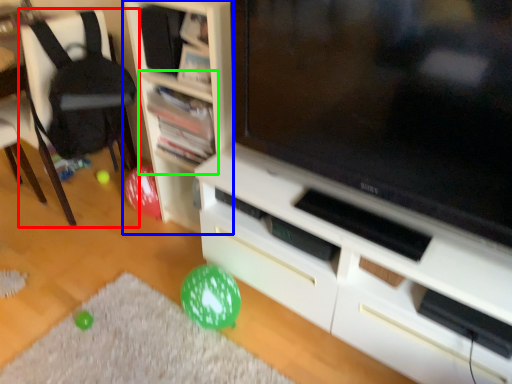
Question: Estimate the real-world distances between objects in this image. Which object is farther from chair (highlighted by a red box), shelf (highlighted by a blue box) or shelf (highlighted by a green box)?

Choices:
 (A) shelf
 (B) shelf

Answer: (A)